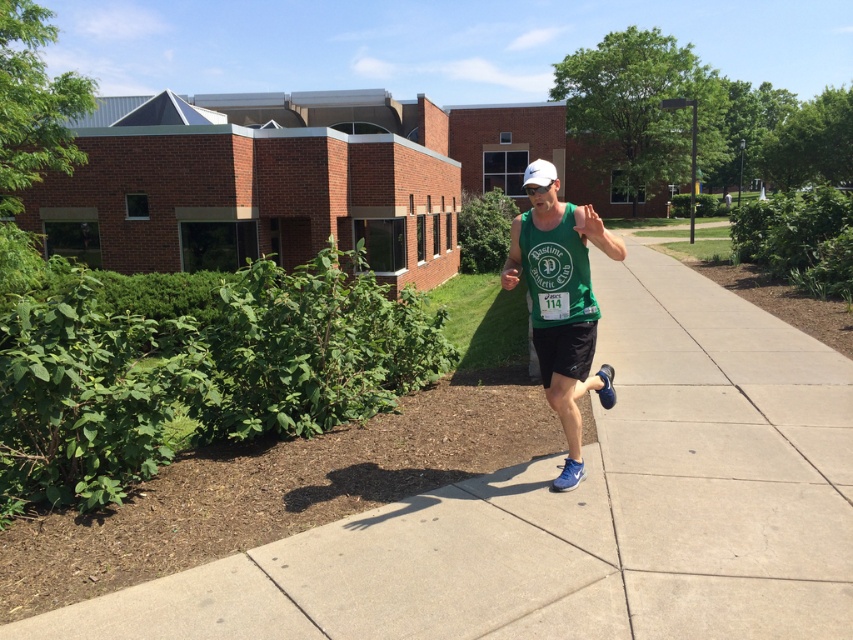
Question: Is gray concrete sidewalk at center in front of green fabric tank top at center?

Choices:
 (A) yes
 (B) no

Answer: (A)

Question: Does gray concrete sidewalk at center come behind green fabric tank top at center?

Choices:
 (A) yes
 (B) no

Answer: (B)

Question: Which object appears closest to the camera in this image?

Choices:
 (A) gray concrete sidewalk at center
 (B) green fabric tank top at center

Answer: (A)

Question: Can you confirm if gray concrete sidewalk at center is positioned to the left of green fabric tank top at center?

Choices:
 (A) no
 (B) yes

Answer: (A)